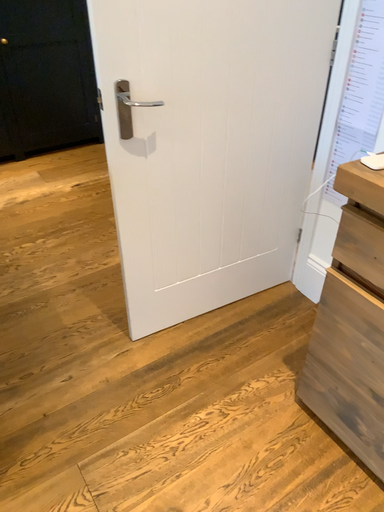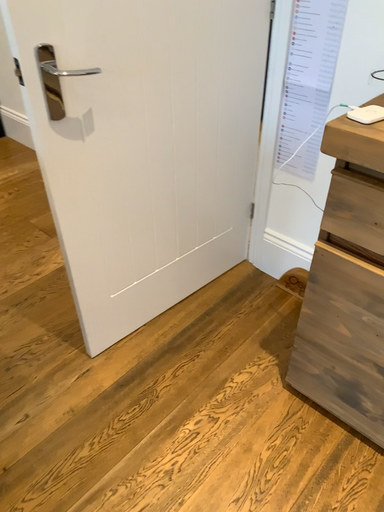
Question: Which way did the camera rotate in the video?

Choices:
 (A) rotated left
 (B) rotated right

Answer: (B)